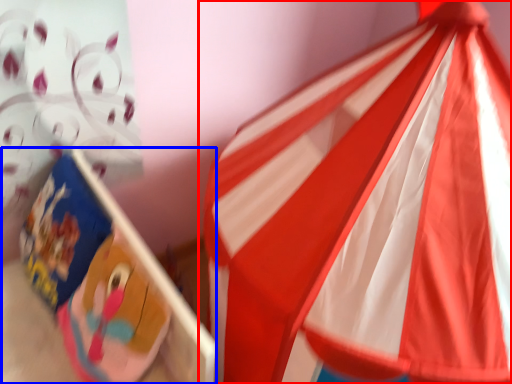
Question: Which point is closer to the camera, flag (highlighted by a red box) or cardboard box (highlighted by a blue box)?

Choices:
 (A) flag
 (B) cardboard box

Answer: (A)